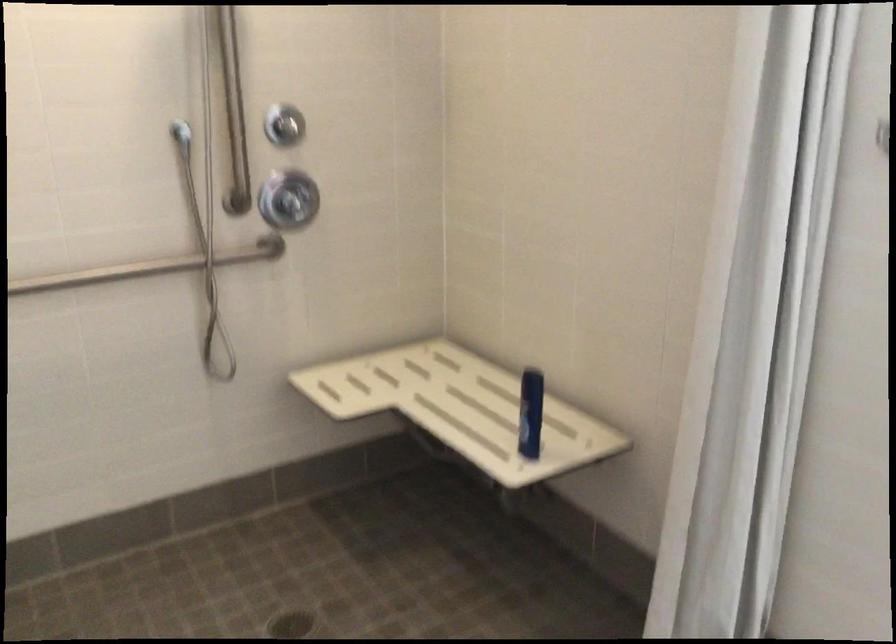
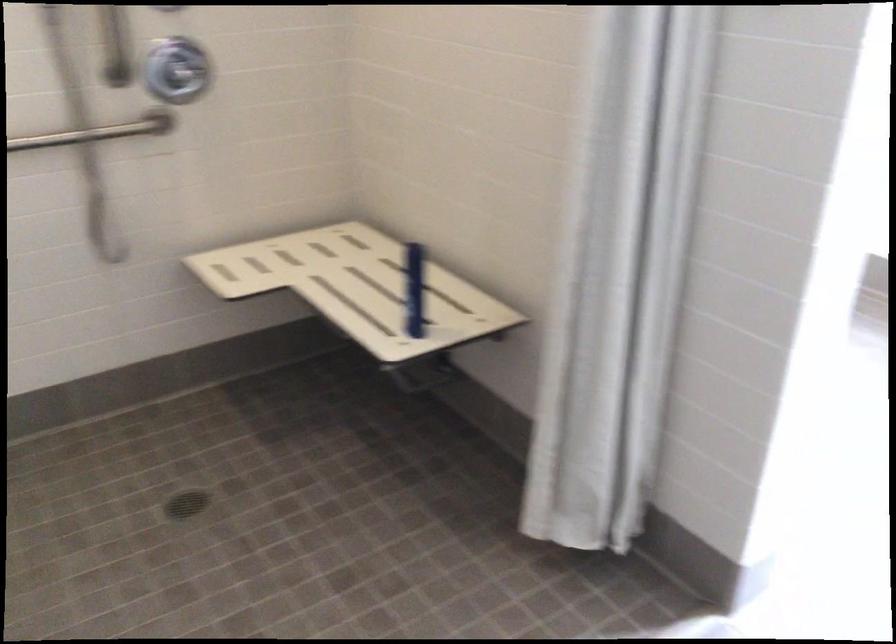
Question: The first image is from the beginning of the video and the second image is from the end. How did the camera likely rotate when shooting the video?

Choices:
 (A) Left
 (B) Right
 (C) Up
 (D) Down

Answer: (D)